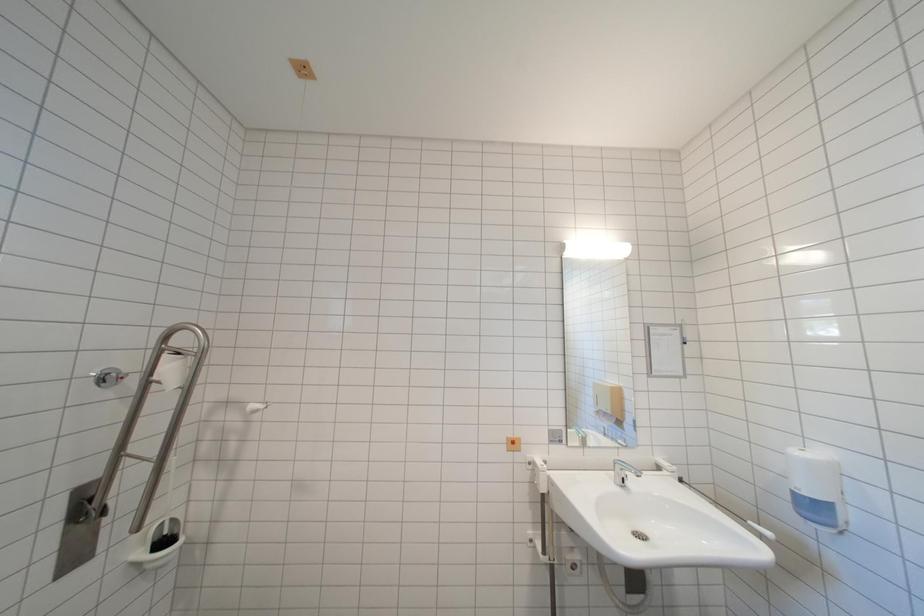
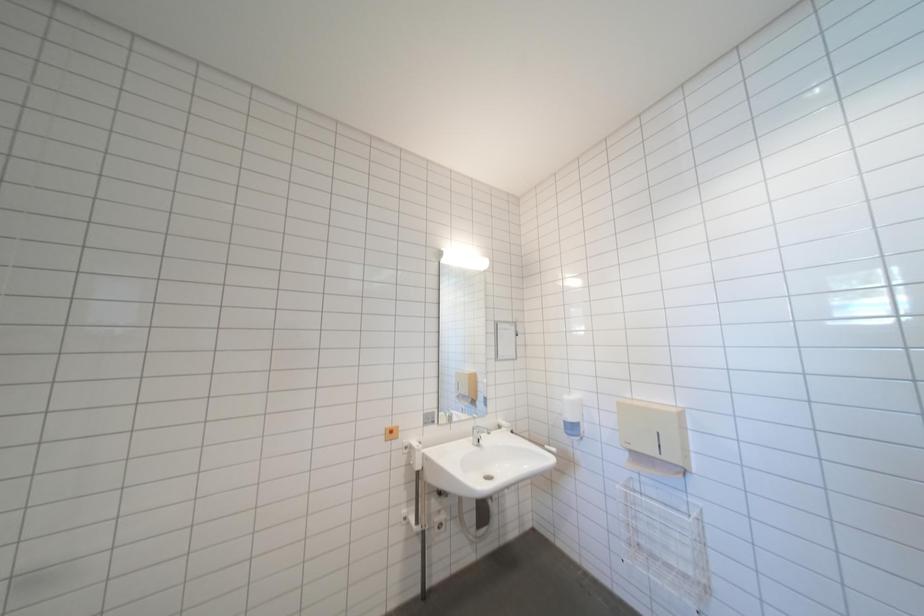
Question: The first image is from the beginning of the video and the second image is from the end. How did the camera likely rotate when shooting the video?

Choices:
 (A) Left
 (B) Right
 (C) Up
 (D) Down

Answer: (B)